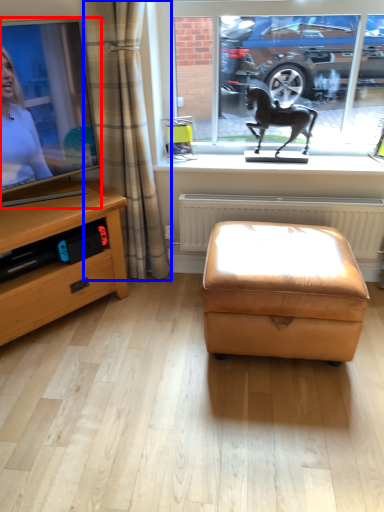
Question: Among these objects, which one is nearest to the camera, television (highlighted by a red box) or curtain (highlighted by a blue box)?

Choices:
 (A) television
 (B) curtain

Answer: (A)